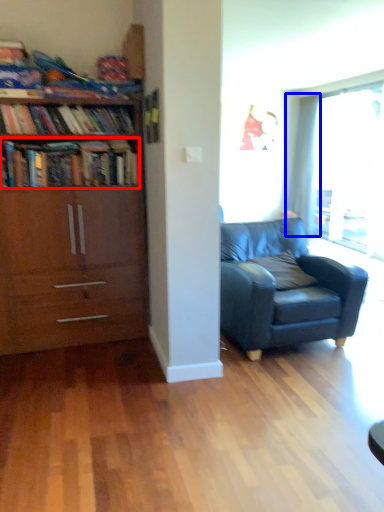
Question: Which object is closer to the camera taking this photo, book (highlighted by a red box) or curtain (highlighted by a blue box)?

Choices:
 (A) book
 (B) curtain

Answer: (A)